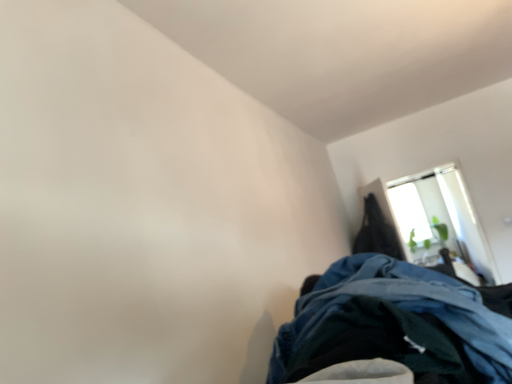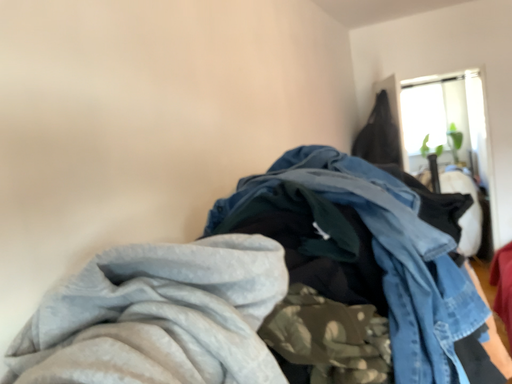
Question: How did the camera likely rotate when shooting the video?

Choices:
 (A) rotated downward
 (B) rotated upward

Answer: (A)